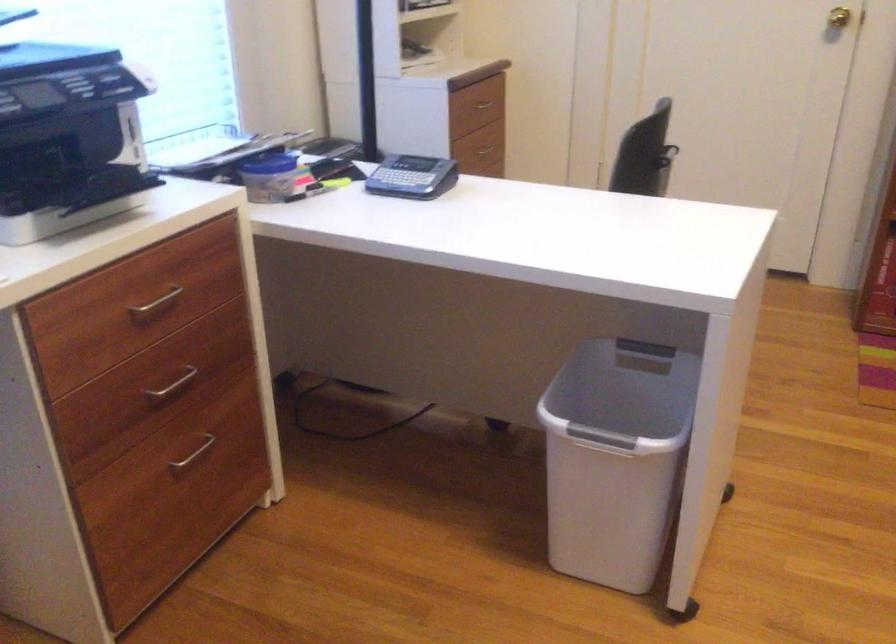
Find where to lift the blue container lid. Please return your answer as a coordinate pair (x, y).

(270, 164)